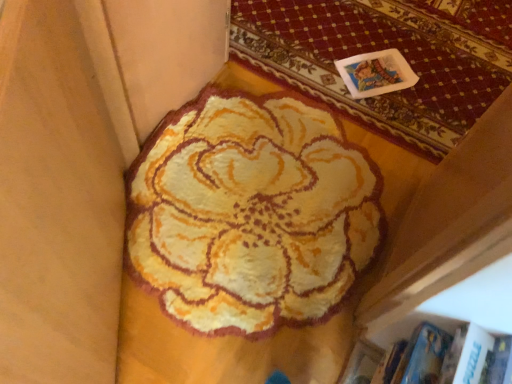
Question: Considering the positions of fluffy yellow rug at center and fluffy yellow rug at upper center in the image, is fluffy yellow rug at center taller or shorter than fluffy yellow rug at upper center?

Choices:
 (A) short
 (B) tall

Answer: (B)

Question: Which is correct: fluffy yellow rug at center is inside fluffy yellow rug at upper center, or outside of it?

Choices:
 (A) outside
 (B) inside

Answer: (A)

Question: In terms of width, does fluffy yellow rug at center look wider or thinner when compared to fluffy yellow rug at upper center?

Choices:
 (A) thin
 (B) wide

Answer: (B)

Question: Considering their positions, is fluffy yellow rug at upper center located in front of or behind fluffy yellow rug at center?

Choices:
 (A) front
 (B) behind

Answer: (B)

Question: From a real-world perspective, is fluffy yellow rug at upper center above or below fluffy yellow rug at center?

Choices:
 (A) below
 (B) above

Answer: (A)

Question: From the image's perspective, is fluffy yellow rug at upper center above or below fluffy yellow rug at center?

Choices:
 (A) above
 (B) below

Answer: (A)

Question: In terms of height, does fluffy yellow rug at upper center look taller or shorter compared to fluffy yellow rug at center?

Choices:
 (A) tall
 (B) short

Answer: (B)